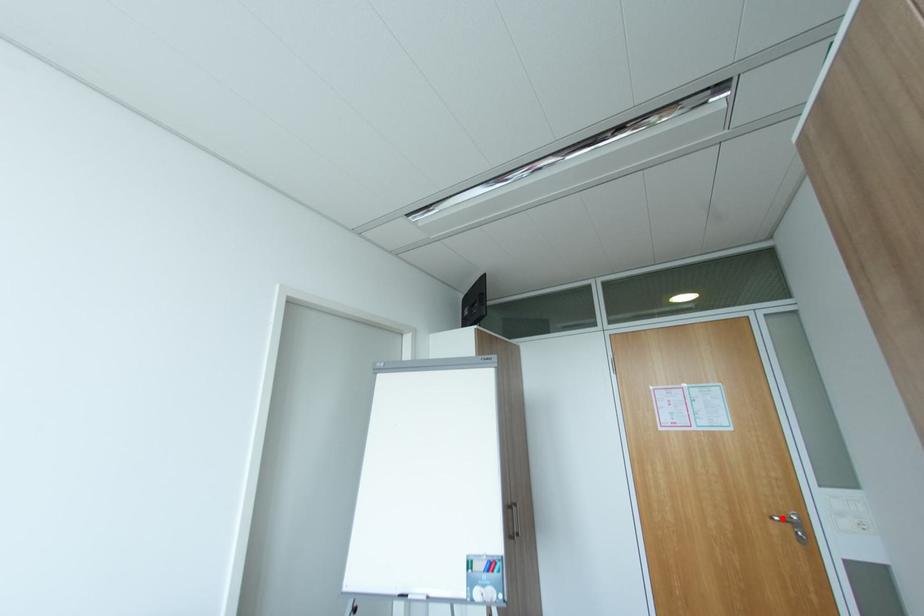
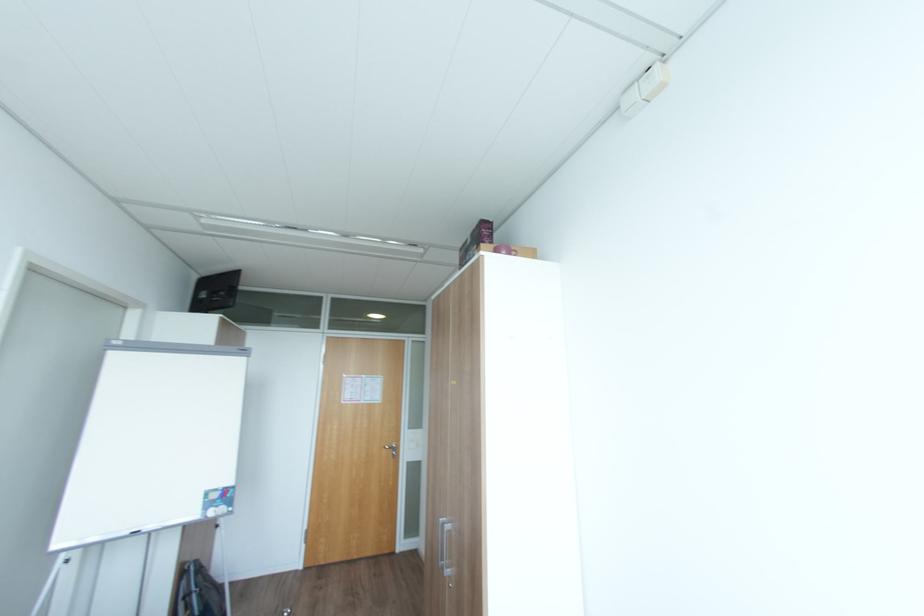
Question: I am providing you with two images of the same scene from different viewpoints. A red point is marked on the first image. Is the red point's position out of view in image 2?

Choices:
 (A) Yes
 (B) No

Answer: (B)